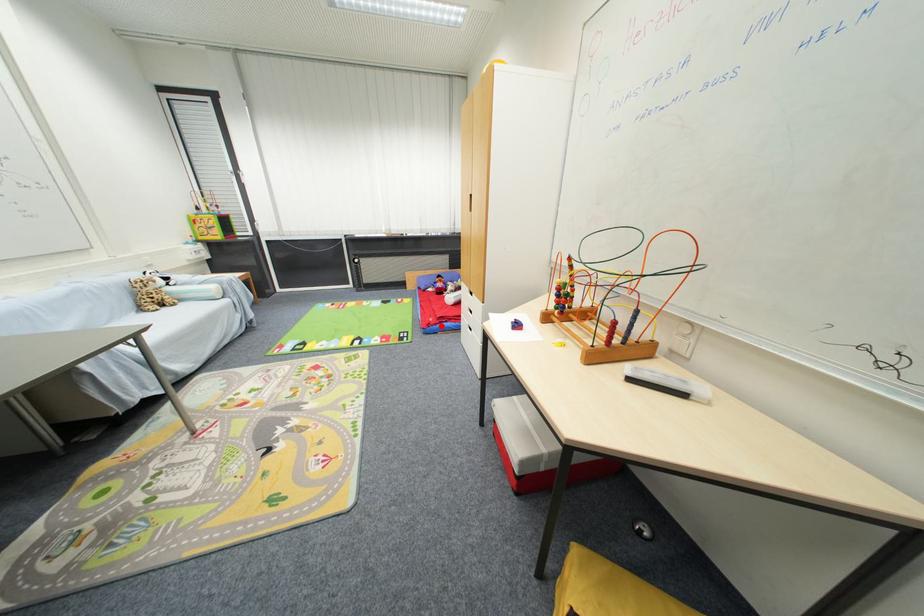
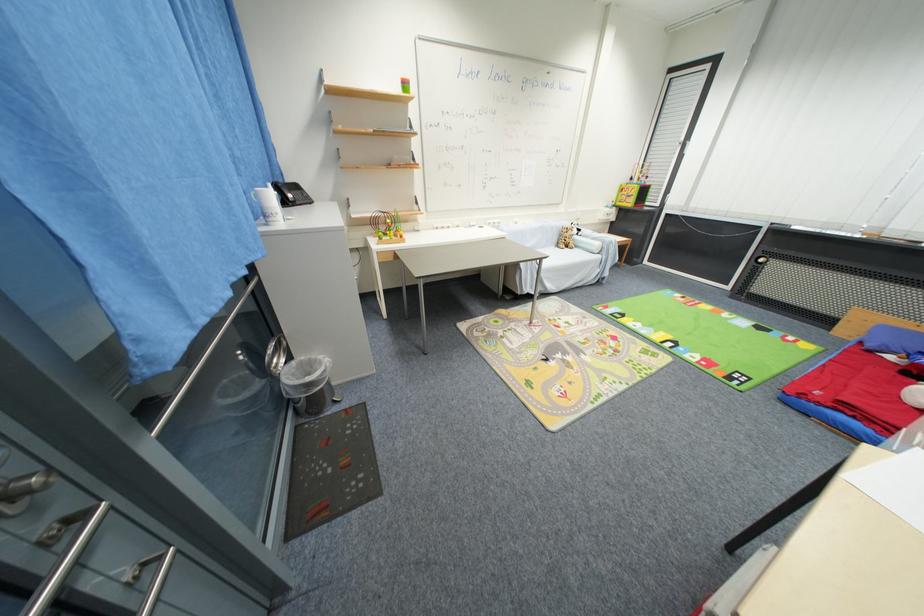
Question: I am providing you with two images of the same scene from different viewpoints. Given a red point in image1, look at the same physical point in image2. Is it:

Choices:
 (A) Closer to the viewpoint
 (B) Farther from the viewpoint

Answer: (B)